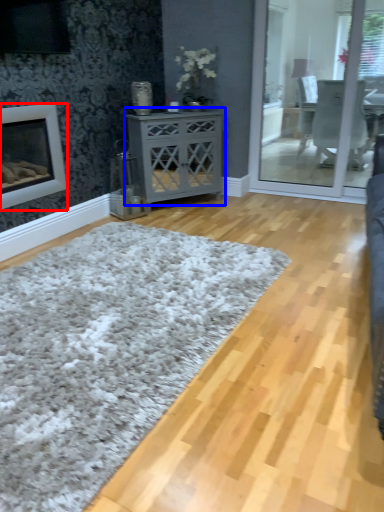
Question: Which of the following is the farthest to the observer, fireplace (highlighted by a red box) or nightstand (highlighted by a blue box)?

Choices:
 (A) fireplace
 (B) nightstand

Answer: (B)